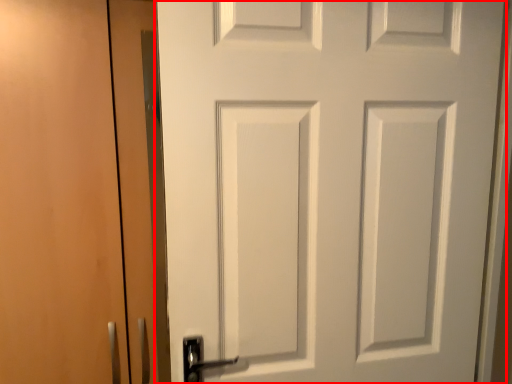
Question: Considering the relative positions of door (annotated by the red box) and garage door in the image provided, where is door (annotated by the red box) located with respect to the staircase?

Choices:
 (A) left
 (B) right

Answer: (B)